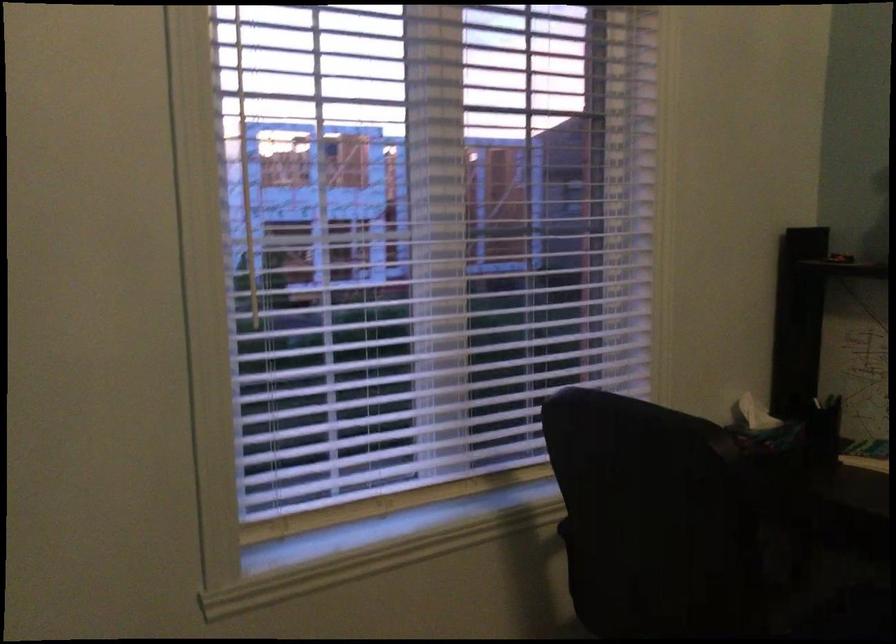
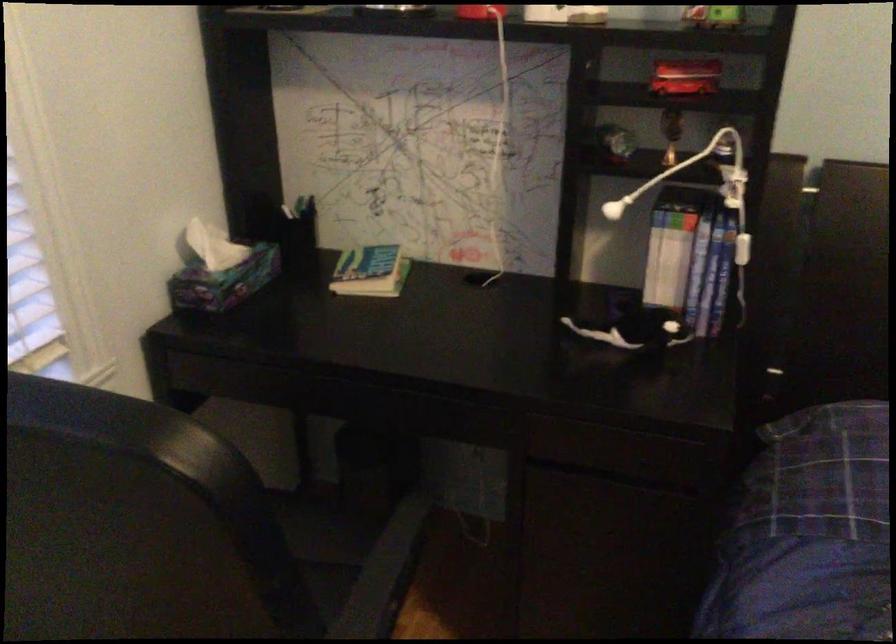
In the second image, find the point that corresponds to point (733, 469) in the first image.

(234, 509)